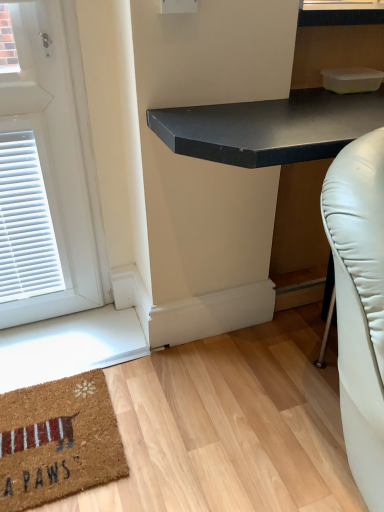
Identify the location of unoccupied area behind brown coir mat at lower left. This screenshot has width=384, height=512. (81, 346).